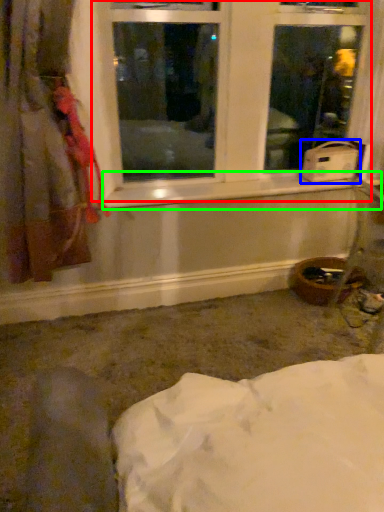
Question: Considering the real-world distances, which object is closest to window (highlighted by a red box)? water heater (highlighted by a blue box) or window sill (highlighted by a green box).

Choices:
 (A) water heater
 (B) window sill

Answer: (B)